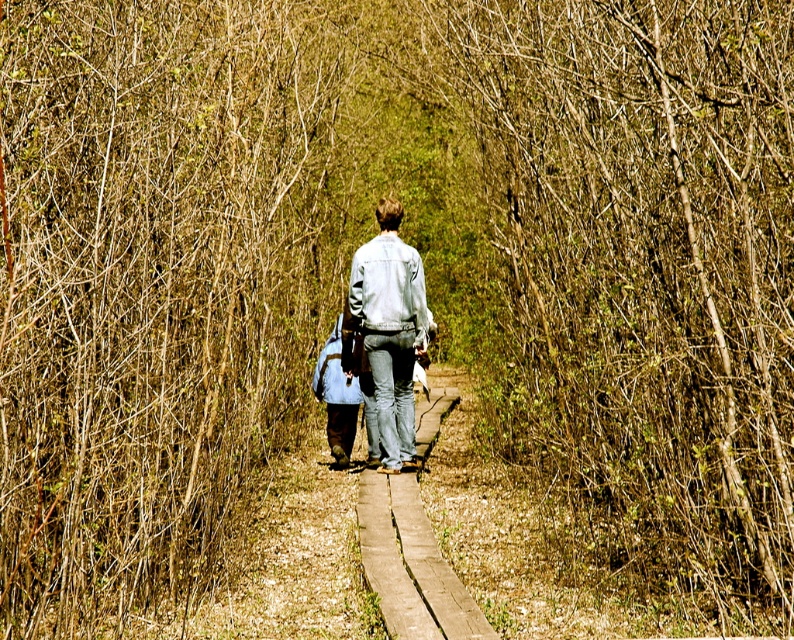
Can you confirm if brown leafless trees at center is positioned below denim jacket at center?

Actually, brown leafless trees at center is above denim jacket at center.

How much distance is there between brown leafless trees at center and denim jacket at center?

brown leafless trees at center and denim jacket at center are 6.72 feet apart from each other.

Who is more distant from viewer, (338, 90) or (357, 291)?

The point (338, 90) is more distant.

Where is `brown leafless trees at center`? Image resolution: width=794 pixels, height=640 pixels. brown leafless trees at center is located at coordinates (153, 288).